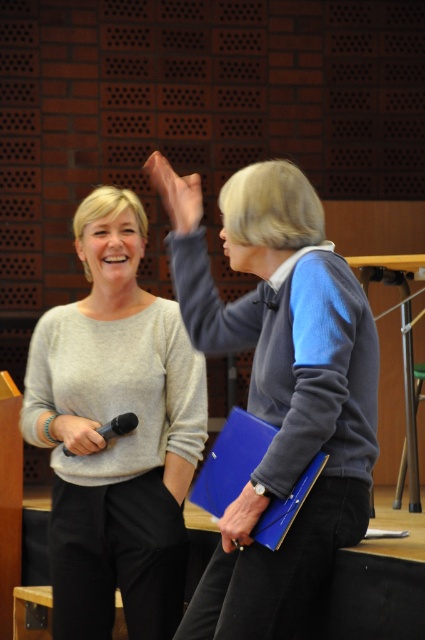
Question: Among these objects, which one is nearest to the camera?

Choices:
 (A) blue corduroy sweater at center
 (B) matte gray sweater at center

Answer: (A)

Question: Which point is closer to the camera taking this photo?

Choices:
 (A) (280, 614)
 (B) (147, 493)

Answer: (A)

Question: Is blue corduroy sweater at center closer to the viewer compared to matte gray sweater at center?

Choices:
 (A) no
 (B) yes

Answer: (B)

Question: Is the position of blue corduroy sweater at center more distant than that of matte gray sweater at center?

Choices:
 (A) no
 (B) yes

Answer: (A)

Question: Does blue corduroy sweater at center have a lesser width compared to matte gray sweater at center?

Choices:
 (A) yes
 (B) no

Answer: (B)